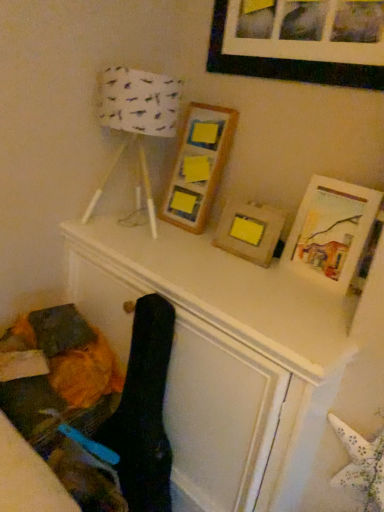
Question: Is white paper lampshade at upper left positioned in front of black matte picture frame at upper center, placed as the 4th picture frame when sorted from bottom to top?

Choices:
 (A) yes
 (B) no

Answer: (B)

Question: Can you confirm if white paper lampshade at upper left is smaller than black matte picture frame at upper center, which ranks as the first picture frame in top-to-bottom order?

Choices:
 (A) no
 (B) yes

Answer: (A)

Question: Can you confirm if white paper lampshade at upper left is bigger than black matte picture frame at upper center, placed as the 4th picture frame when sorted from bottom to top?

Choices:
 (A) no
 (B) yes

Answer: (B)

Question: Is white paper lampshade at upper left to the left of black matte picture frame at upper center, placed as the 4th picture frame when sorted from bottom to top, from the viewer's perspective?

Choices:
 (A) yes
 (B) no

Answer: (A)

Question: Is white paper lampshade at upper left to the right of black matte picture frame at upper center, placed as the 4th picture frame when sorted from bottom to top, from the viewer's perspective?

Choices:
 (A) yes
 (B) no

Answer: (B)

Question: From their relative heights in the image, would you say matte wooden picture frame at upper right, positioned as the 1th picture frame in bottom-to-top order, is taller or shorter than black matte picture frame at upper center, which ranks as the first picture frame in top-to-bottom order?

Choices:
 (A) short
 (B) tall

Answer: (B)

Question: From a real-world perspective, relative to black matte picture frame at upper center, placed as the 4th picture frame when sorted from bottom to top, is matte wooden picture frame at upper right, positioned as the 1th picture frame in bottom-to-top order, vertically above or below?

Choices:
 (A) below
 (B) above

Answer: (A)

Question: Is matte wooden picture frame at upper right, positioned as the 1th picture frame in bottom-to-top order, to the left or to the right of black matte picture frame at upper center, which ranks as the first picture frame in top-to-bottom order, in the image?

Choices:
 (A) right
 (B) left

Answer: (A)

Question: Is matte wooden picture frame at upper right, positioned as the 1th picture frame in bottom-to-top order, in front of or behind black matte picture frame at upper center, which ranks as the first picture frame in top-to-bottom order, in the image?

Choices:
 (A) behind
 (B) front

Answer: (A)

Question: From a real-world perspective, is wooden frame at center, which appears as the second picture frame when viewed from the top, above or below white paper lampshade at upper left?

Choices:
 (A) above
 (B) below

Answer: (B)

Question: Is wooden frame at center, which appears as the second picture frame when viewed from the top, situated inside white paper lampshade at upper left or outside?

Choices:
 (A) inside
 (B) outside

Answer: (B)

Question: Is point click(218, 115) closer or farther from the camera than point click(107, 102)?

Choices:
 (A) closer
 (B) farther

Answer: (B)

Question: Considering the relative positions of wooden frame at center, the 3th picture frame positioned from the bottom, and white paper lampshade at upper left in the image provided, is wooden frame at center, the 3th picture frame positioned from the bottom, to the left or to the right of white paper lampshade at upper left?

Choices:
 (A) left
 (B) right

Answer: (B)

Question: Is point (190, 161) positioned closer to the camera than point (284, 248)?

Choices:
 (A) closer
 (B) farther

Answer: (B)

Question: Visually, is wooden frame at center, which appears as the second picture frame when viewed from the top, positioned to the left or to the right of matte wooden picture frame at upper right, arranged as the 4th picture frame when viewed from the top?

Choices:
 (A) right
 (B) left

Answer: (B)